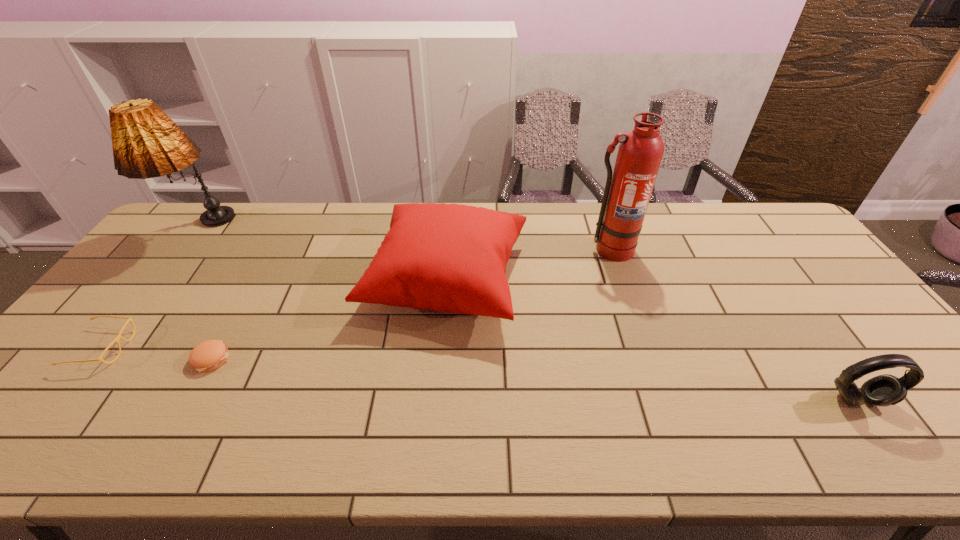
The height and width of the screenshot is (540, 960). Find the location of `object that is at the far left corner`. object that is at the far left corner is located at coordinates (146, 143).

Find the location of a particular element. The width and height of the screenshot is (960, 540). free space at the far edge of the desktop is located at coordinates (313, 237).

I want to click on blank area at the near edge, so click(779, 443).

This screenshot has height=540, width=960. In the image, there is a desktop. In order to click on blank space at the left edge in this screenshot , I will do `click(87, 388)`.

The width and height of the screenshot is (960, 540). In the image, there is a desktop. Identify the location of free space at the right edge. pos(809,307).

Identify the location of vacant area at the far right corner. The image size is (960, 540). click(x=764, y=205).

The height and width of the screenshot is (540, 960). What are the coordinates of `vacant space at the near right corner of the desktop` in the screenshot? It's located at (947, 451).

Find the location of a particular element. vacant region between the spectacles and the fourth object from right to left is located at coordinates (157, 353).

Where is `empty location between the patty and the spectacles`? empty location between the patty and the spectacles is located at coordinates (157, 353).

Find the location of a particular element. vacant area that lies between the second object from right to left and the cushion is located at coordinates (528, 265).